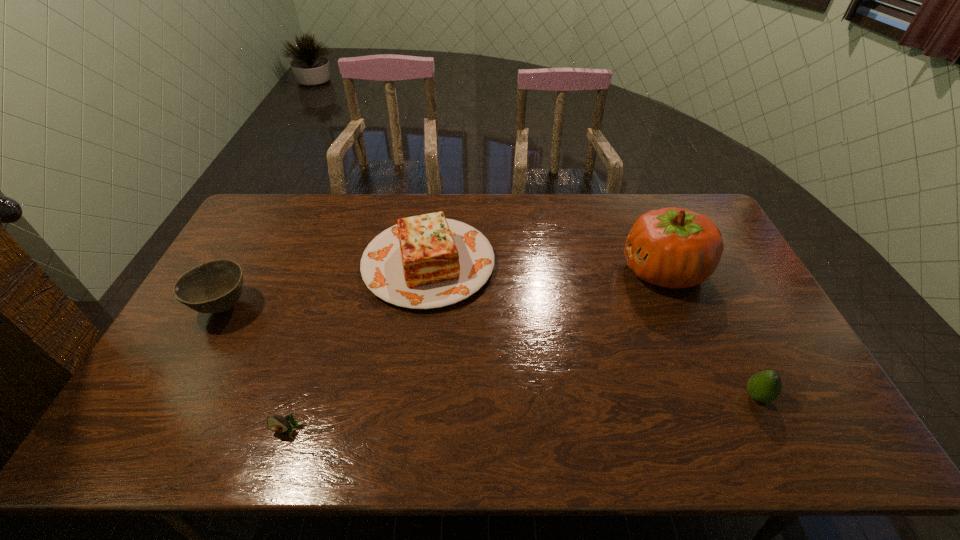
Locate an element on the screen. empty space that is in between the pumpkin and the lasagna is located at coordinates (546, 267).

Point out which object is positioned as the nearest to the pumpkin. Please provide its 2D coordinates. Your answer should be formatted as a tuple, i.e. [(x, y)], where the tuple contains the x and y coordinates of a point satisfying the conditions above.

[(765, 386)]

Identify which object is located as the fourth nearest to the shortest object. Please provide its 2D coordinates. Your answer should be formatted as a tuple, i.e. [(x, y)], where the tuple contains the x and y coordinates of a point satisfying the conditions above.

[(765, 386)]

Where is `vacant position in the image that satisfies the following two spatial constraints: 1. on the side of the pumpkin with the cute face; 2. on the front side of the bowl`? The width and height of the screenshot is (960, 540). vacant position in the image that satisfies the following two spatial constraints: 1. on the side of the pumpkin with the cute face; 2. on the front side of the bowl is located at coordinates (679, 307).